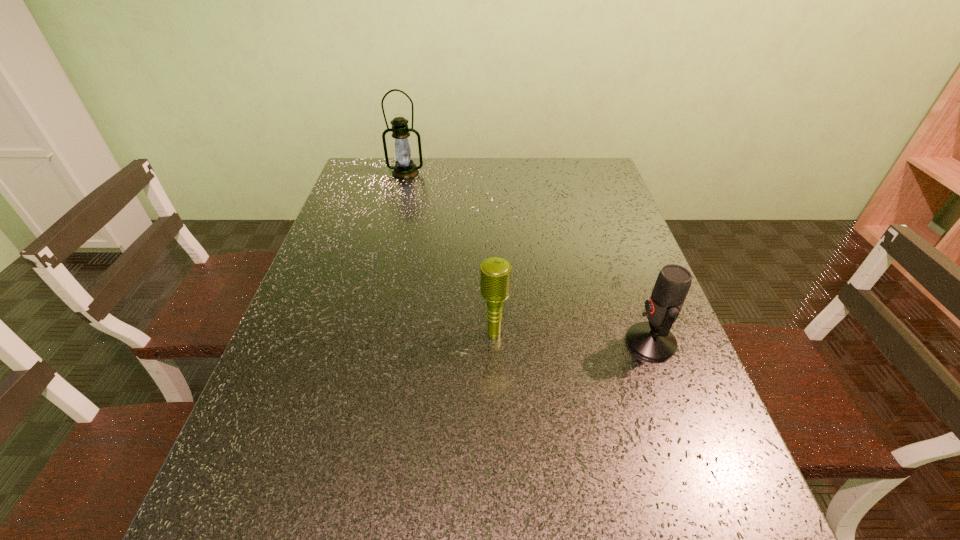
I want to click on vacant area that satisfies the following two spatial constraints: 1. on the side where the second object from left to right emits light; 2. on the left side of the lantern, so click(x=365, y=334).

Locate an element on the screen. The height and width of the screenshot is (540, 960). vacant area that satisfies the following two spatial constraints: 1. on the side where the farthest object emits light; 2. on the right side of the left microphone is located at coordinates (365, 334).